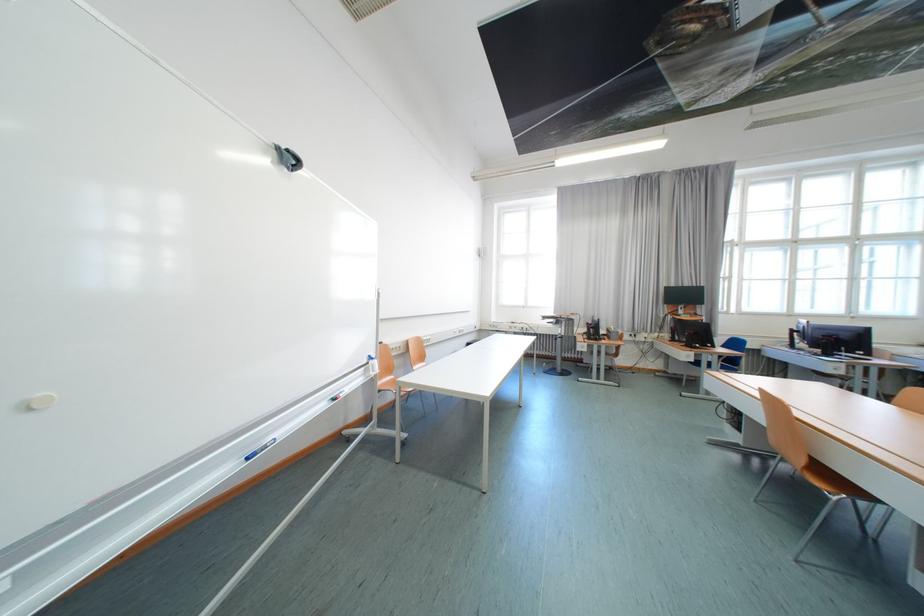
This screenshot has height=616, width=924. What are the coordinates of `orange chair sitting surface` in the screenshot? It's located at (808, 469).